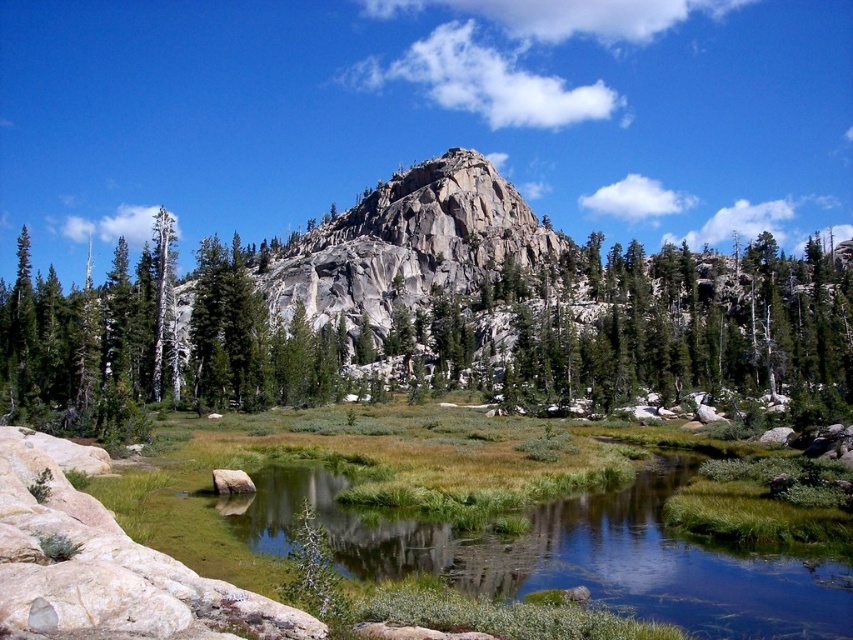
Question: In this image, where is green grassy lake at center located relative to smooth gray rock at center?

Choices:
 (A) above
 (B) below

Answer: (B)

Question: Which of the following is the closest to the observer?

Choices:
 (A) click(x=215, y=481)
 (B) click(x=642, y=541)

Answer: (B)

Question: Considering the relative positions of green grassy lake at center and smooth gray rock at center in the image provided, where is green grassy lake at center located with respect to smooth gray rock at center?

Choices:
 (A) left
 (B) right

Answer: (B)

Question: Is green grassy lake at center wider than smooth gray rock at center?

Choices:
 (A) no
 (B) yes

Answer: (B)